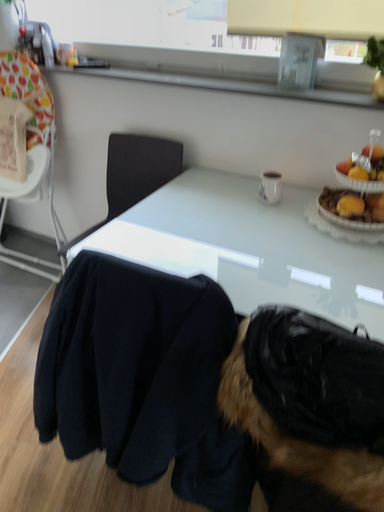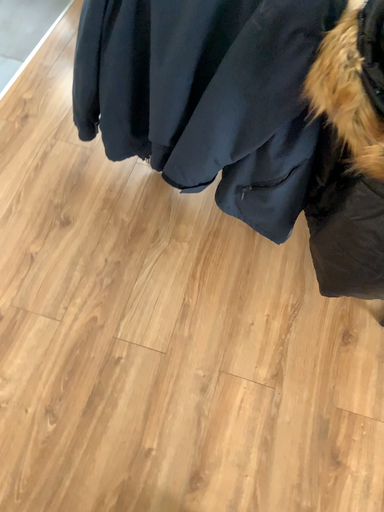
Question: How did the camera likely rotate when shooting the video?

Choices:
 (A) rotated upward
 (B) rotated downward

Answer: (B)